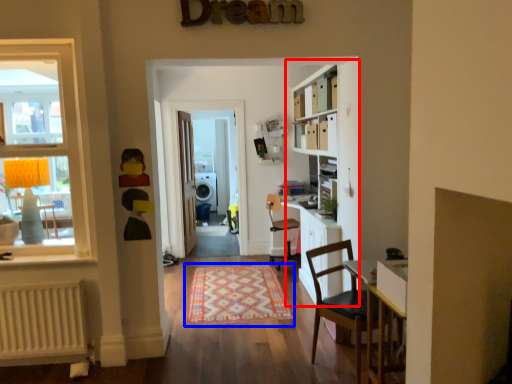
Question: Which object appears farthest to the camera in this image, bookcase (highlighted by a red box) or mat (highlighted by a blue box)?

Choices:
 (A) bookcase
 (B) mat

Answer: (B)